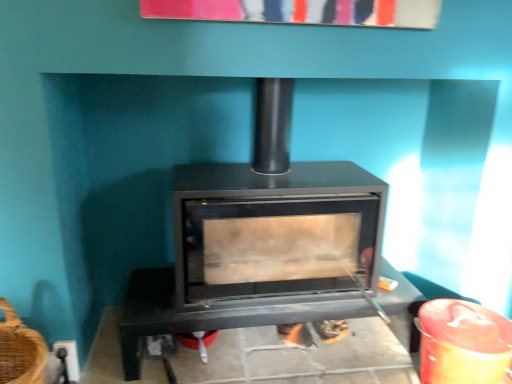
Question: Considering the positions of black matte fireplace at center and black matte wood burning stove at center in the image, is black matte fireplace at center bigger or smaller than black matte wood burning stove at center?

Choices:
 (A) big
 (B) small

Answer: (B)

Question: Looking at their shapes, would you say black matte fireplace at center is wider or thinner than black matte wood burning stove at center?

Choices:
 (A) wide
 (B) thin

Answer: (A)

Question: From the image's perspective, relative to black matte wood burning stove at center, is black matte fireplace at center above or below?

Choices:
 (A) below
 (B) above

Answer: (A)

Question: Relative to black matte fireplace at center, is black matte wood burning stove at center in front or behind?

Choices:
 (A) behind
 (B) front

Answer: (B)

Question: From the image's perspective, relative to black matte fireplace at center, is black matte wood burning stove at center above or below?

Choices:
 (A) above
 (B) below

Answer: (A)

Question: In terms of size, does black matte wood burning stove at center appear bigger or smaller than black matte fireplace at center?

Choices:
 (A) big
 (B) small

Answer: (A)

Question: From their relative heights in the image, would you say black matte wood burning stove at center is taller or shorter than black matte fireplace at center?

Choices:
 (A) tall
 (B) short

Answer: (A)